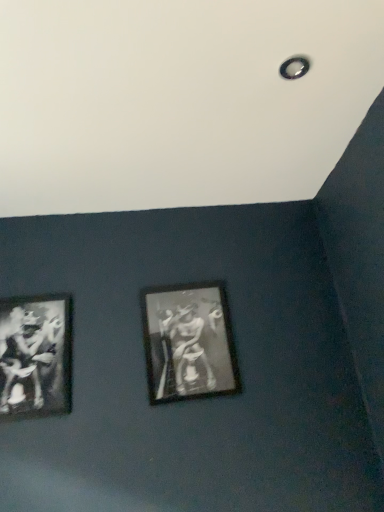
Question: Looking at their shapes, would you say black matte picture frame at lower left, which is counted as the 2th picture frame, starting from the right, is wider or thinner than black matte picture frame at center, positioned as the 2th picture frame in left-to-right order?

Choices:
 (A) wide
 (B) thin

Answer: (B)

Question: Considering the positions of black matte picture frame at lower left, which is counted as the 2th picture frame, starting from the right, and black matte picture frame at center, positioned as the 2th picture frame in left-to-right order, in the image, is black matte picture frame at lower left, which is counted as the 2th picture frame, starting from the right, bigger or smaller than black matte picture frame at center, positioned as the 2th picture frame in left-to-right order,?

Choices:
 (A) small
 (B) big

Answer: (A)

Question: From a real-world perspective, is black matte picture frame at lower left, the first picture frame from the left, physically located above or below black matte picture frame at center, arranged as the first picture frame when viewed from the right?

Choices:
 (A) below
 (B) above

Answer: (B)

Question: Is point (192, 364) closer or farther from the camera than point (11, 305)?

Choices:
 (A) closer
 (B) farther

Answer: (A)

Question: Is black matte picture frame at center, positioned as the 2th picture frame in left-to-right order, wider or thinner than black matte picture frame at lower left, the first picture frame from the left?

Choices:
 (A) wide
 (B) thin

Answer: (A)

Question: Is black matte picture frame at center, positioned as the 2th picture frame in left-to-right order, to the left or to the right of black matte picture frame at lower left, the first picture frame from the left, in the image?

Choices:
 (A) left
 (B) right

Answer: (B)

Question: Would you say black matte picture frame at center, positioned as the 2th picture frame in left-to-right order, is inside or outside black matte picture frame at lower left, the first picture frame from the left?

Choices:
 (A) outside
 (B) inside

Answer: (A)